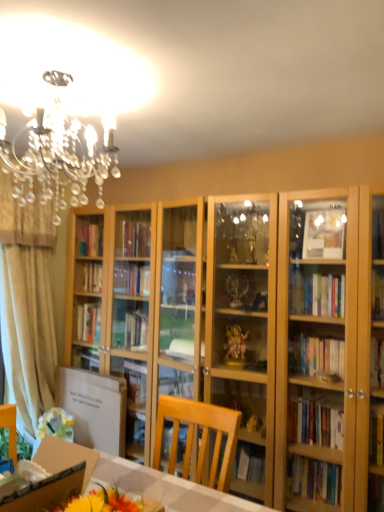
Question: From the image's perspective, is white cardboard box at lower left on beige fabric curtain at left?

Choices:
 (A) yes
 (B) no

Answer: (B)

Question: Does white cardboard box at lower left appear on the left side of beige fabric curtain at left?

Choices:
 (A) yes
 (B) no

Answer: (B)

Question: Does white cardboard box at lower left have a larger size compared to beige fabric curtain at left?

Choices:
 (A) no
 (B) yes

Answer: (A)

Question: Is white cardboard box at lower left thinner than beige fabric curtain at left?

Choices:
 (A) no
 (B) yes

Answer: (A)

Question: Would you say white cardboard box at lower left contains beige fabric curtain at left?

Choices:
 (A) yes
 (B) no

Answer: (B)

Question: Is point (196, 506) closer or farther from the camera than point (31, 489)?

Choices:
 (A) closer
 (B) farther

Answer: (B)

Question: Is wooden desk at lower left in front of or behind white cardboard box at lower left in the image?

Choices:
 (A) behind
 (B) front

Answer: (B)

Question: Would you say wooden desk at lower left is to the left or to the right of white cardboard box at lower left in the picture?

Choices:
 (A) right
 (B) left

Answer: (A)

Question: From a real-world perspective, is wooden desk at lower left above or below white cardboard box at lower left?

Choices:
 (A) below
 (B) above

Answer: (A)

Question: From a real-world perspective, is wooden desk at lower left physically located above or below beige fabric curtain at left?

Choices:
 (A) below
 (B) above

Answer: (A)

Question: Looking at their shapes, would you say wooden desk at lower left is wider or thinner than beige fabric curtain at left?

Choices:
 (A) wide
 (B) thin

Answer: (A)

Question: In the image, is wooden desk at lower left on the left side or the right side of beige fabric curtain at left?

Choices:
 (A) right
 (B) left

Answer: (A)

Question: Based on their sizes in the image, would you say wooden desk at lower left is bigger or smaller than beige fabric curtain at left?

Choices:
 (A) small
 (B) big

Answer: (A)

Question: Is white cardboard box at lower left in front of or behind beige fabric curtain at left in the image?

Choices:
 (A) front
 (B) behind

Answer: (A)

Question: Is point (79, 472) closer or farther from the camera than point (21, 216)?

Choices:
 (A) farther
 (B) closer

Answer: (B)